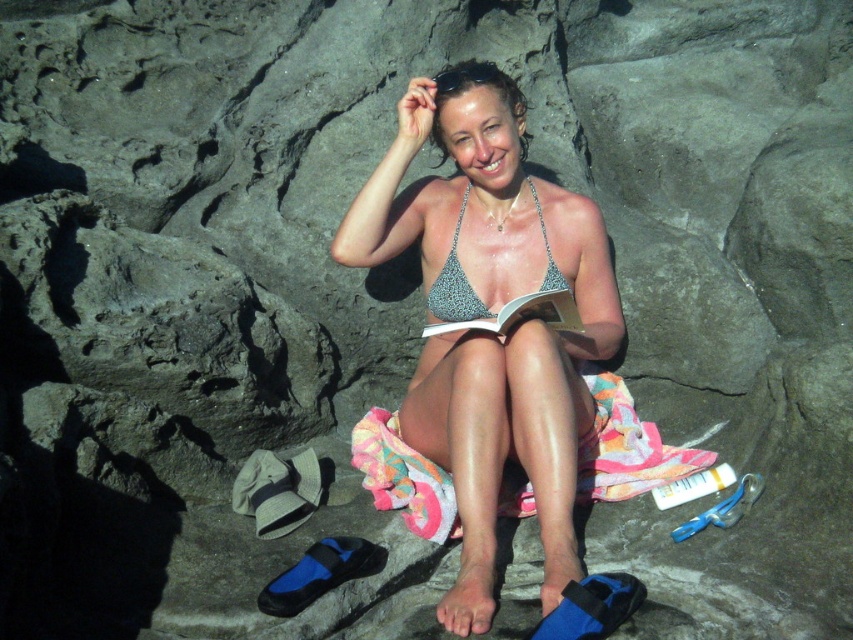
Question: Is metallic bikini top at center positioned at the back of sparkly silver bikini top at center?

Choices:
 (A) no
 (B) yes

Answer: (A)

Question: Considering the relative positions of metallic bikini top at center and sparkly silver bikini top at center in the image provided, where is metallic bikini top at center located with respect to sparkly silver bikini top at center?

Choices:
 (A) above
 (B) below

Answer: (B)

Question: Which object is closer to the camera taking this photo?

Choices:
 (A) metallic bikini top at center
 (B) sparkly silver bikini top at center

Answer: (A)

Question: Can you confirm if metallic bikini top at center is wider than sparkly silver bikini top at center?

Choices:
 (A) no
 (B) yes

Answer: (B)

Question: Which of the following is the farthest from the observer?

Choices:
 (A) metallic bikini top at center
 (B) sparkly silver bikini top at center

Answer: (B)